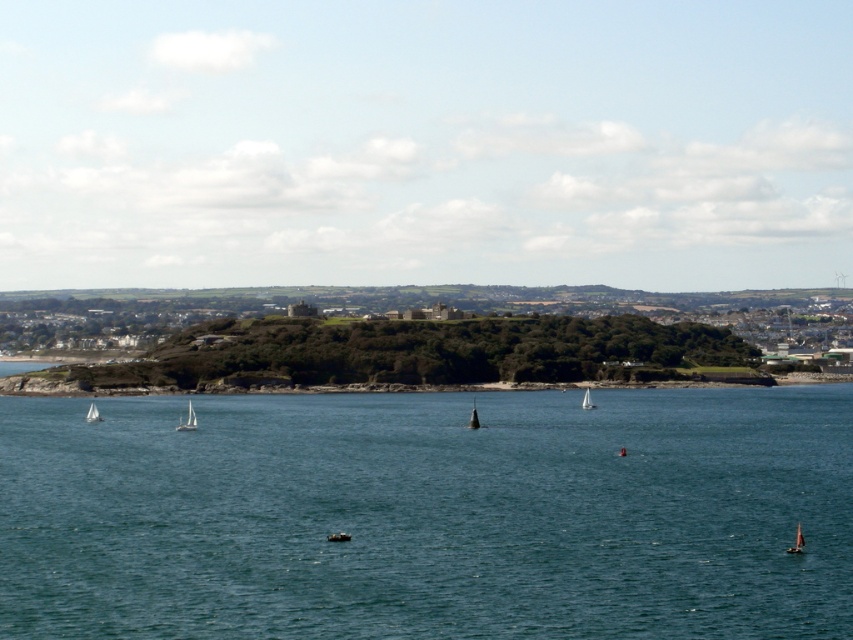
Which is behind, point (473, 413) or point (585, 394)?

The point (585, 394) is more distant.

Who is lower down, black matte sailboat at center or white sailboat at center?

black matte sailboat at center is below.

Between point (476, 422) and point (584, 394), which one is positioned behind?

Positioned behind is point (584, 394).

Identify the location of black matte sailboat at center. The image size is (853, 640). (473, 417).

Is white matte sailboat at center-left positioned before white sailboat at center?

Yes, it is.

Which is behind, point (183, 426) or point (589, 394)?

The point (589, 394) is more distant.

You are a GUI agent. You are given a task and a screenshot of the screen. Output one action in this format:
    pyautogui.click(x=<x>, y=<y>)
    Task: Click on the white matte sailboat at center-left
    The image size is (853, 640).
    Given the screenshot: What is the action you would take?
    pyautogui.click(x=187, y=420)

Can you confirm if white matte sailboat at center-left is positioned above white matte sailboat at lower left?

Incorrect, white matte sailboat at center-left is not positioned above white matte sailboat at lower left.

Which is in front, point (183, 426) or point (90, 420)?

Point (183, 426) is more forward.

Locate an element on the screen. This screenshot has width=853, height=640. white matte sailboat at center-left is located at coordinates (187, 420).